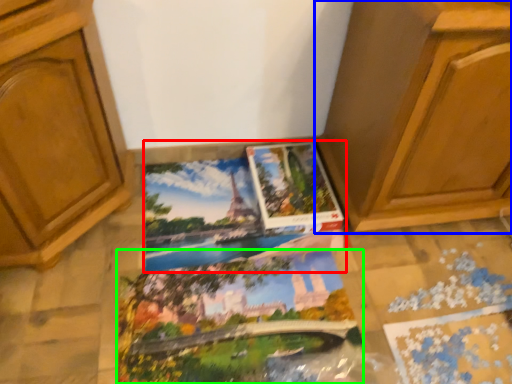
Question: Based on their relative distances, which object is farther from coloring book (highlighted by a red box)? Choose from cabinetry (highlighted by a blue box) and coloring book (highlighted by a green box).

Choices:
 (A) cabinetry
 (B) coloring book

Answer: (A)